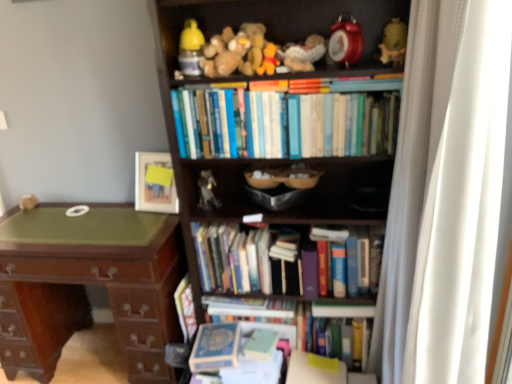
Question: Looking at their shapes, would you say matte wooden picture frame at upper center is wider or thinner than white plush toy at left, the 1th toy when ordered from left to right?

Choices:
 (A) thin
 (B) wide

Answer: (A)

Question: From the image's perspective, relative to white plush toy at left, the 1th toy when ordered from left to right, is matte wooden picture frame at upper center above or below?

Choices:
 (A) below
 (B) above

Answer: (B)

Question: Estimate the real-world distances between objects in this image. Which object is closer to the green polished wood desk at left?

Choices:
 (A) hardcover books at center, the 4th book when ordered from bottom to top
 (B) white fabric curtain at right
 (C) white plush toy at left, the ninth toy from the right
 (D) hardcover books at center, the second book when ordered from bottom to top
 (E) yellow rubber duck at upper center, the 4th toy viewed from the right

Answer: (A)

Question: Which of these objects is positioned closest to the matte yellow ceramic vase at upper right, the first toy when ordered from right to left?

Choices:
 (A) metallic silver figurine at center, the seventh toy positioned from the right
 (B) hardcover books at center, the second book when ordered from bottom to top
 (C) fuzzy fabric stuffed animal at upper center, the 5th toy positioned from the left
 (D) hardcover books at center, which is the first book from top to bottom
 (E) matte yellow plastic bottle at upper center, which is the eighth toy in right-to-left order

Answer: (D)